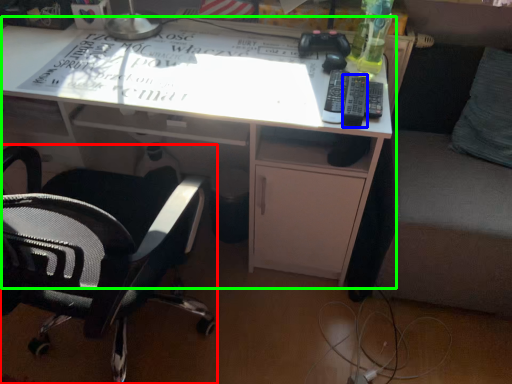
Question: Based on their relative distances, which object is farther from chair (highlighted by a red box)? Choose from remote (highlighted by a blue box) and desk (highlighted by a green box).

Choices:
 (A) remote
 (B) desk

Answer: (A)